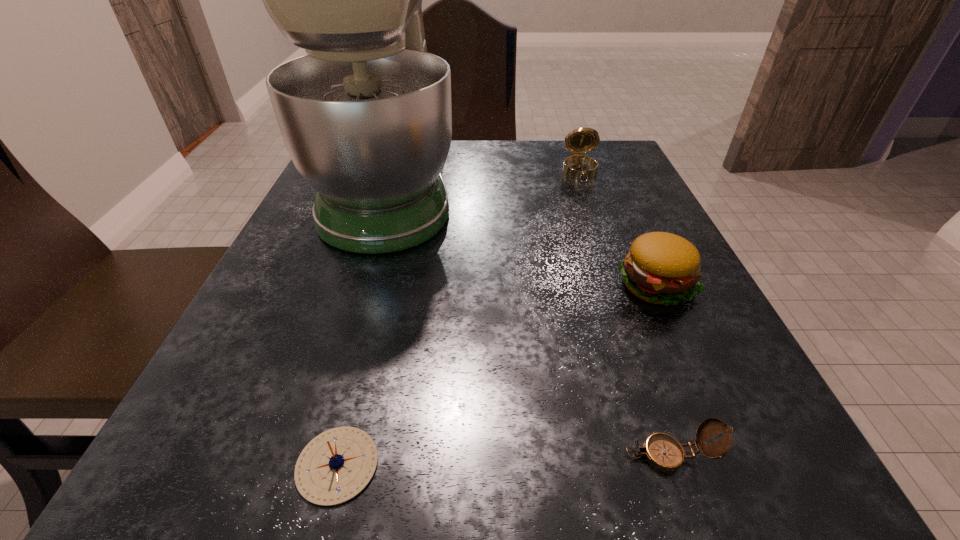
This screenshot has height=540, width=960. Find the location of `free spot between the tallest compass and the shortest object`. free spot between the tallest compass and the shortest object is located at coordinates (459, 318).

Locate an element on the screen. This screenshot has width=960, height=540. object that is the closest to the farthest compass is located at coordinates (366, 117).

Point out which object is positioned as the second nearest to the third nearest object. Please provide its 2D coordinates. Your answer should be formatted as a tuple, i.e. [(x, y)], where the tuple contains the x and y coordinates of a point satisfying the conditions above.

[(366, 117)]

Select which compass appears as the second closest to the tallest compass. Please provide its 2D coordinates. Your answer should be formatted as a tuple, i.e. [(x, y)], where the tuple contains the x and y coordinates of a point satisfying the conditions above.

[(335, 466)]

Image resolution: width=960 pixels, height=540 pixels. What are the coordinates of `compass object that ranks as the closest to the tallest compass` in the screenshot? It's located at (662, 451).

Locate an element on the screen. Image resolution: width=960 pixels, height=540 pixels. free space that satisfies the following two spatial constraints: 1. on the controls of the mixer; 2. on the right side of the leftmost compass is located at coordinates (309, 465).

This screenshot has height=540, width=960. Find the location of `vacant space that satisfies the following two spatial constraints: 1. with the dial facing the tallest compass; 2. on the controls of the mixer`. vacant space that satisfies the following two spatial constraints: 1. with the dial facing the tallest compass; 2. on the controls of the mixer is located at coordinates (587, 190).

The width and height of the screenshot is (960, 540). I want to click on vacant space that satisfies the following two spatial constraints: 1. on the controls of the shortest object; 2. on the left side of the tallest object, so click(x=309, y=465).

Locate an element on the screen. The image size is (960, 540). vacant area in the image that satisfies the following two spatial constraints: 1. on the back side of the leftmost compass; 2. on the controls of the tallest object is located at coordinates (406, 190).

You are a GUI agent. You are given a task and a screenshot of the screen. Output one action in this format:
    pyautogui.click(x=<x>, y=<y>)
    Task: Click on the vacant space that satisfies the following two spatial constraints: 1. on the back side of the shortest object; 2. on the controls of the mixer
    
    Given the screenshot: What is the action you would take?
    pyautogui.click(x=406, y=190)